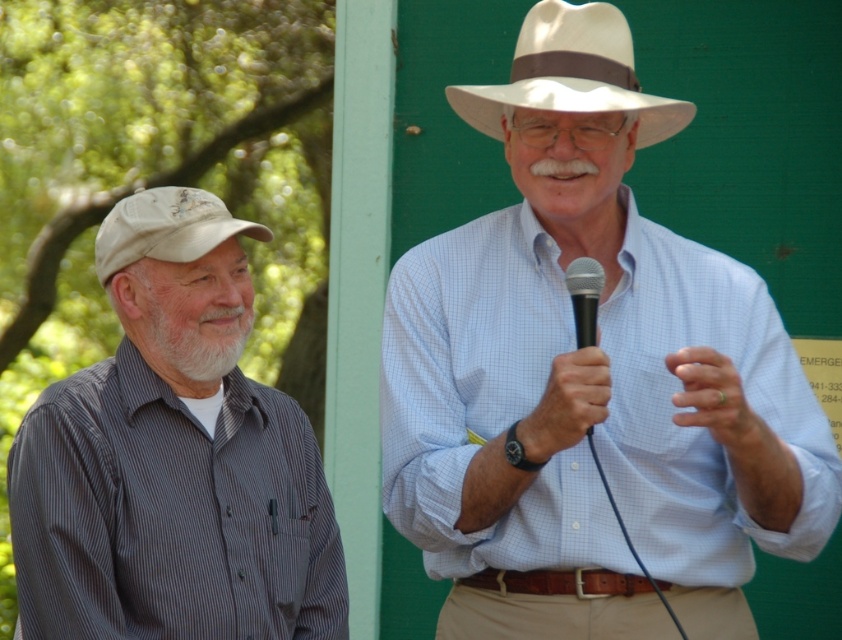
Question: Is gray striped shirt at left smaller than white felt fedora at upper center?

Choices:
 (A) no
 (B) yes

Answer: (A)

Question: Can you confirm if khaki cotton pants at center is wider than beige fabric cap at left?

Choices:
 (A) yes
 (B) no

Answer: (A)

Question: Which object appears closest to the camera in this image?

Choices:
 (A) beige fabric cap at left
 (B) black plastic microphone at center
 (C) white matte hat at center

Answer: (B)

Question: Which of the following is the closest to the observer?

Choices:
 (A) white matte hat at center
 (B) beige fabric cap at left

Answer: (A)

Question: Estimate the real-world distances between objects in this image. Which object is closer to the gray striped shirt at left?

Choices:
 (A) white matte hat at center
 (B) beige fabric cap at left
 (C) khaki cotton pants at center

Answer: (B)

Question: Observing the image, what is the correct spatial positioning of khaki cotton pants at center in reference to beige fabric cap at left?

Choices:
 (A) below
 (B) above

Answer: (A)